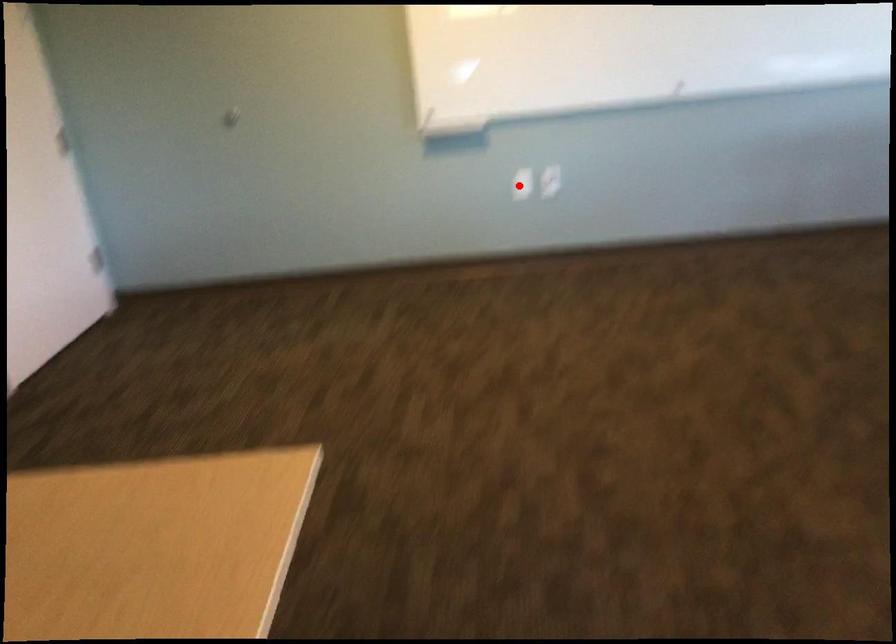
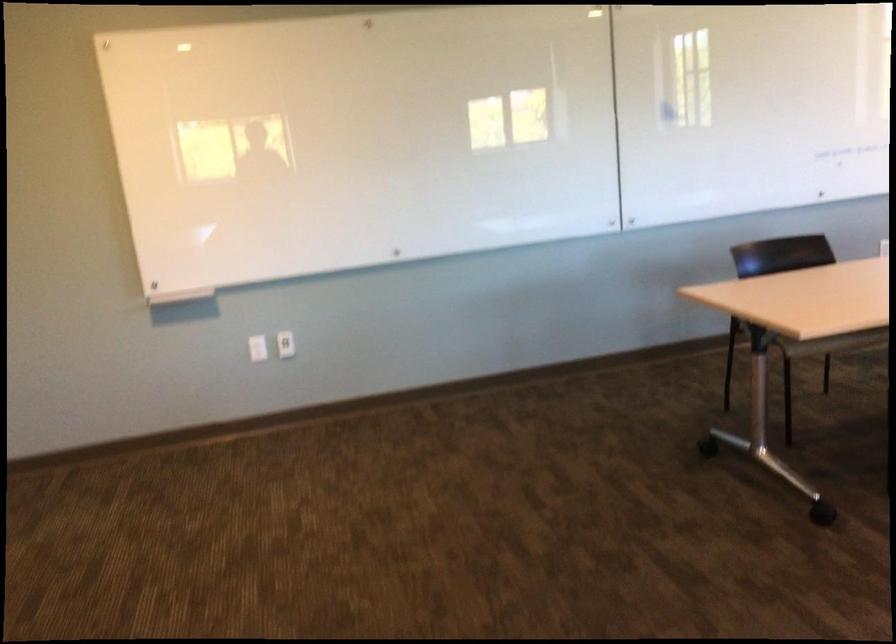
Locate, in the second image, the point that corresponds to the highlighted location in the first image.

(256, 348)